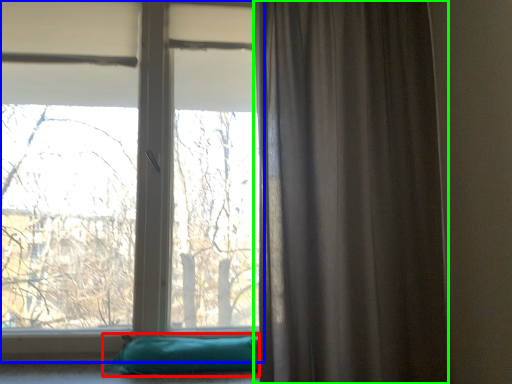
Question: Considering the real-world distances, which object is closest to pillow (highlighted by a red box)? window (highlighted by a blue box) or curtain (highlighted by a green box).

Choices:
 (A) window
 (B) curtain

Answer: (B)